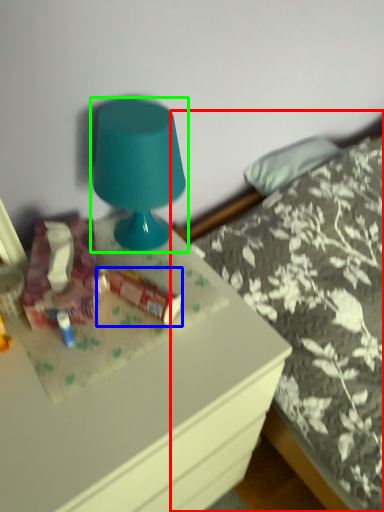
Question: Which object is the farthest from bed (highlighted by a red box)? Choose among these: stuff (highlighted by a blue box) or lamp (highlighted by a green box).

Choices:
 (A) stuff
 (B) lamp

Answer: (A)